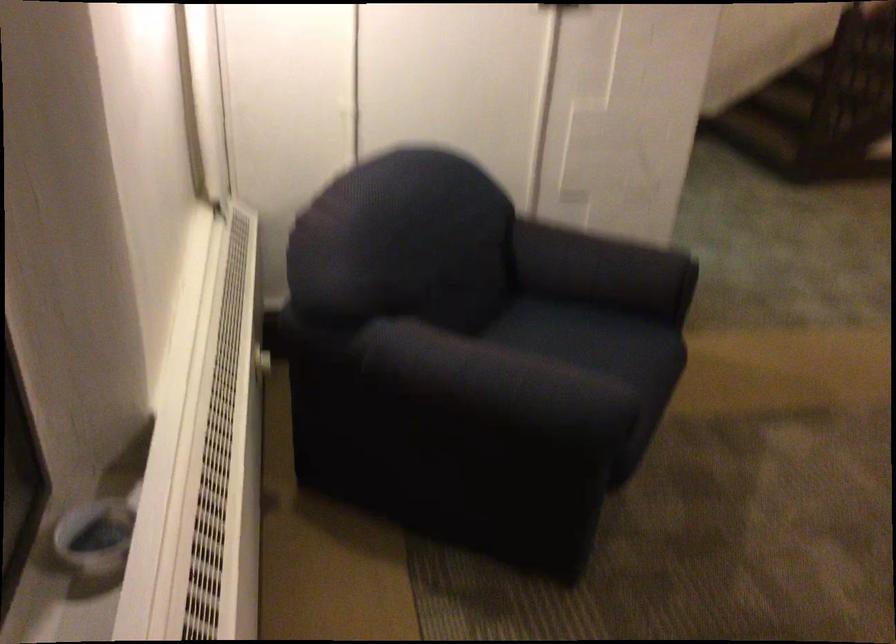
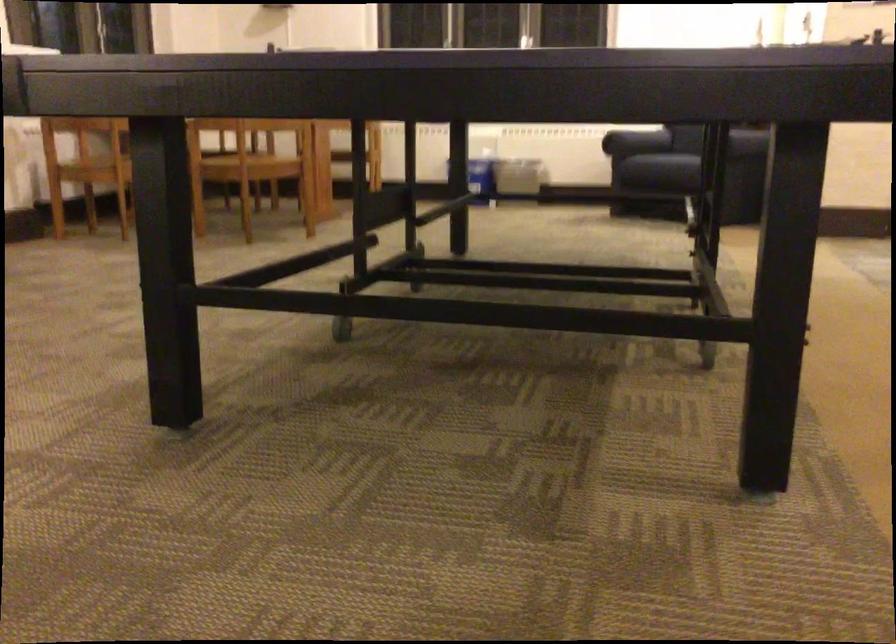
Question: I am providing you with two images of the same scene from different viewpoints. After the viewpoint changes to image2, which objects are now occluded?

Choices:
 (A) chair sitting surface
 (B) sofa armrest
 (C) white metal stool
 (D) white radiator dial

Answer: (D)